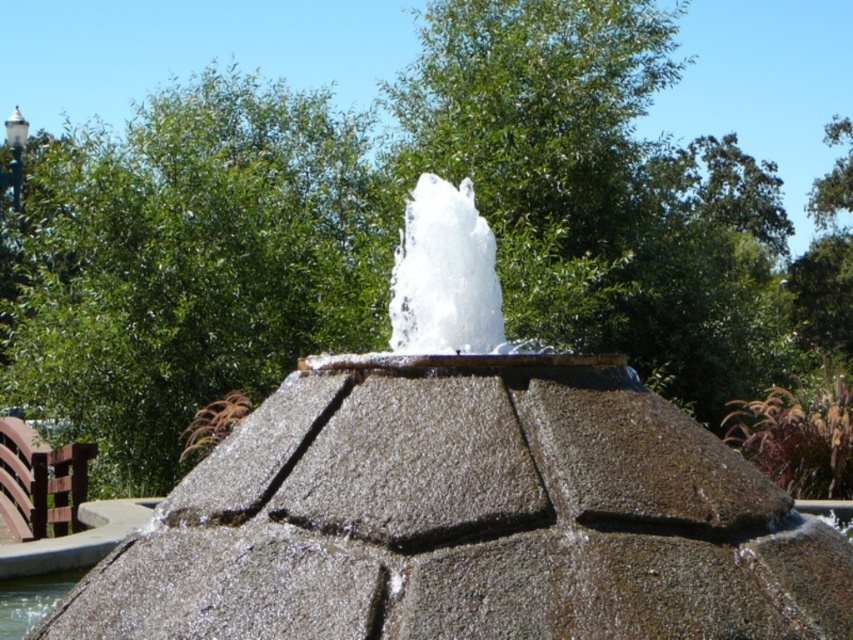
You are standing in a park and see the white frothy water at center and the clear water at fountain center. Which one is above the other?

The white frothy water at center is positioned over the clear water at fountain center.

You are a landscape architect designing a new garden. You need to ensure that the gray stone fountain at center is visible above the clear water at fountain center. Based on the scene description, will the fountain be visible above the water?

Yes, the gray stone fountain at center is taller than the clear water at fountain center, so it will be visible above the water.

You are a maintenance worker who needs to clean the gray stone fountain at center and the white frothy water at center. If your cleaning tool can only reach 30 inches, can you clean both objects without moving closer?

The distance between the gray stone fountain at center and the white frothy water at center is 32.27 inches, which is beyond the 30 inches reach of your tool. Therefore, you cannot clean both without moving closer.